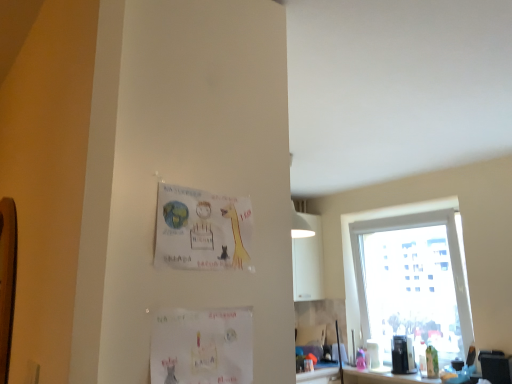
Question: Is white paper postcard at lower center, which is counted as the 1th postcard, starting from the bottom, beside transparent glass window at right?

Choices:
 (A) no
 (B) yes

Answer: (A)

Question: Is white paper postcard at lower center, which is counted as the 1th postcard, starting from the bottom, outside transparent glass window at right?

Choices:
 (A) no
 (B) yes

Answer: (B)

Question: From a real-world perspective, is white paper postcard at lower center, placed as the 2th postcard when sorted from top to bottom, positioned over transparent glass window at right based on gravity?

Choices:
 (A) no
 (B) yes

Answer: (A)

Question: Can you confirm if white paper postcard at lower center, which is counted as the 1th postcard, starting from the bottom, is thinner than transparent glass window at right?

Choices:
 (A) yes
 (B) no

Answer: (A)

Question: Considering the relative sizes of white paper postcard at lower center, placed as the 2th postcard when sorted from top to bottom, and transparent glass window at right in the image provided, is white paper postcard at lower center, placed as the 2th postcard when sorted from top to bottom, taller than transparent glass window at right?

Choices:
 (A) yes
 (B) no

Answer: (B)

Question: Looking at their shapes, would you say white paper postcard at lower center, which is counted as the 1th postcard, starting from the bottom, is wider or thinner than matte paper postcard at upper center, marked as the first postcard in a top-to-bottom arrangement?

Choices:
 (A) thin
 (B) wide

Answer: (A)

Question: From the image's perspective, is white paper postcard at lower center, placed as the 2th postcard when sorted from top to bottom, located above or below matte paper postcard at upper center, marked as the first postcard in a top-to-bottom arrangement?

Choices:
 (A) below
 (B) above

Answer: (A)

Question: From a real-world perspective, relative to matte paper postcard at upper center, marked as the first postcard in a top-to-bottom arrangement, is white paper postcard at lower center, which is counted as the 1th postcard, starting from the bottom, vertically above or below?

Choices:
 (A) below
 (B) above

Answer: (A)

Question: Choose the correct answer: Is white paper postcard at lower center, which is counted as the 1th postcard, starting from the bottom, inside matte paper postcard at upper center, the second postcard ordered from the bottom, or outside it?

Choices:
 (A) inside
 (B) outside

Answer: (B)

Question: Is transparent glass window at right bigger or smaller than white paper postcard at lower center, placed as the 2th postcard when sorted from top to bottom?

Choices:
 (A) big
 (B) small

Answer: (A)

Question: From the image's perspective, relative to white paper postcard at lower center, placed as the 2th postcard when sorted from top to bottom, is transparent glass window at right above or below?

Choices:
 (A) below
 (B) above

Answer: (A)

Question: In terms of width, does transparent glass window at right look wider or thinner when compared to white paper postcard at lower center, placed as the 2th postcard when sorted from top to bottom?

Choices:
 (A) wide
 (B) thin

Answer: (A)

Question: In the image, is transparent glass window at right positioned in front of or behind white paper postcard at lower center, which is counted as the 1th postcard, starting from the bottom?

Choices:
 (A) behind
 (B) front

Answer: (A)

Question: From the image's perspective, relative to transparent glass window at right, is wooden bulletin board at left above or below?

Choices:
 (A) above
 (B) below

Answer: (A)

Question: Is wooden bulletin board at left situated inside transparent glass window at right or outside?

Choices:
 (A) inside
 (B) outside

Answer: (B)